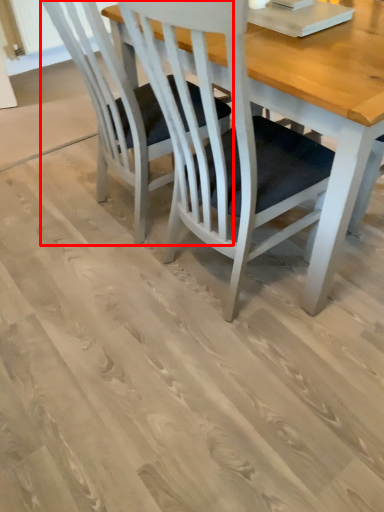
Question: In this image, where is chair (annotated by the red box) located relative to table?

Choices:
 (A) left
 (B) right

Answer: (A)